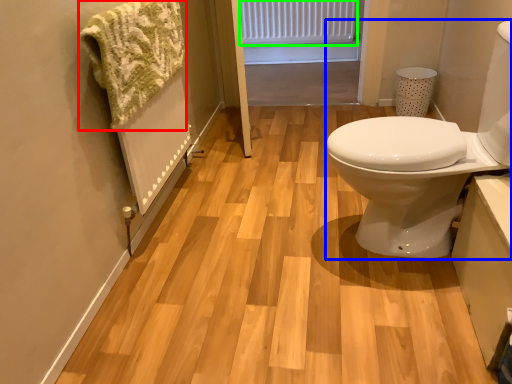
Question: Considering the real-world distances, which object is closest to bath towel (highlighted by a red box)? sink (highlighted by a blue box) or radiator (highlighted by a green box).

Choices:
 (A) sink
 (B) radiator

Answer: (A)